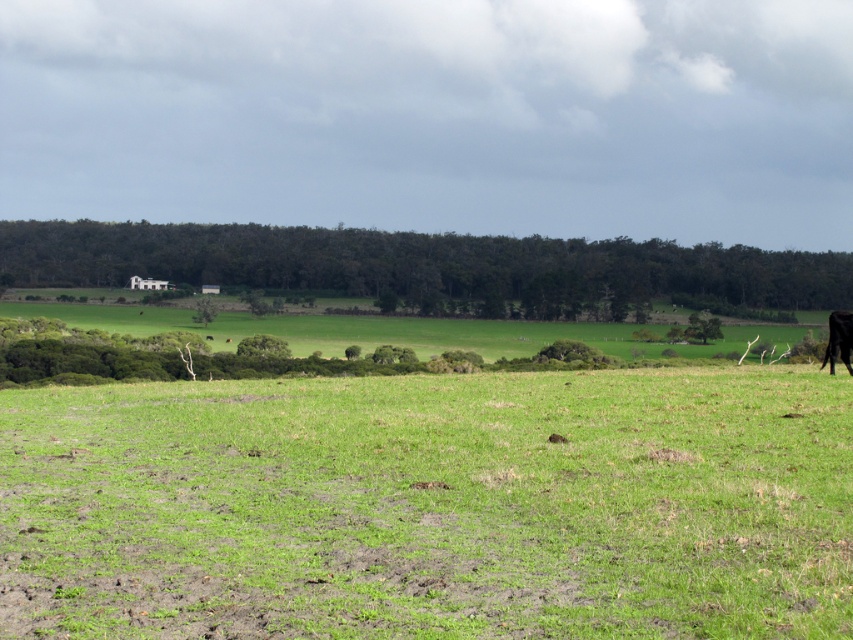
You are a hiker trying to decide between two paths. One path leads over the green grassy hillside at upper center, and the other goes near the black fur at right. If you want to take the wider path, which one should you choose?

The green grassy hillside at upper center might be wider than black fur at right, so you should choose the path over the green grassy hillside at upper center.